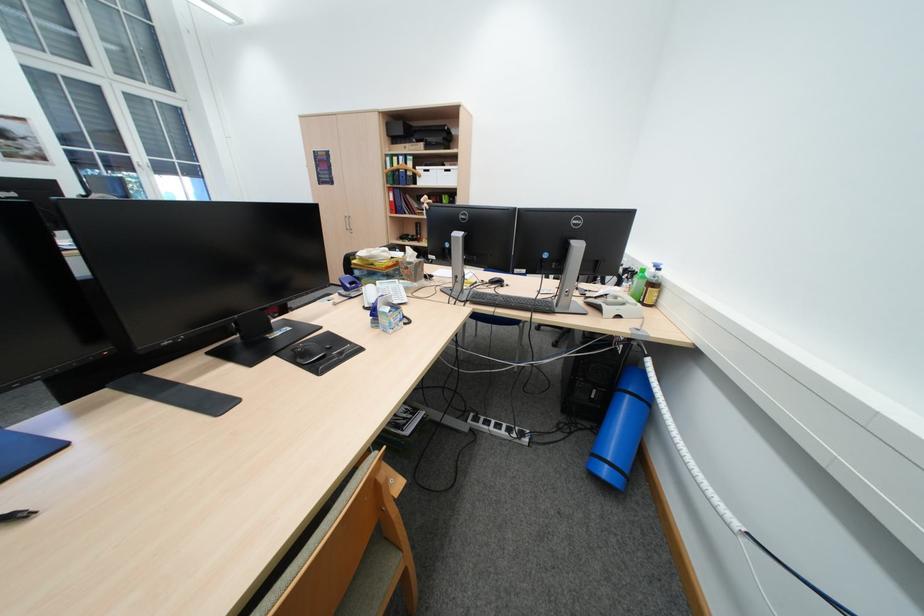
This screenshot has height=616, width=924. I want to click on blue hole puncher, so click(x=349, y=284).